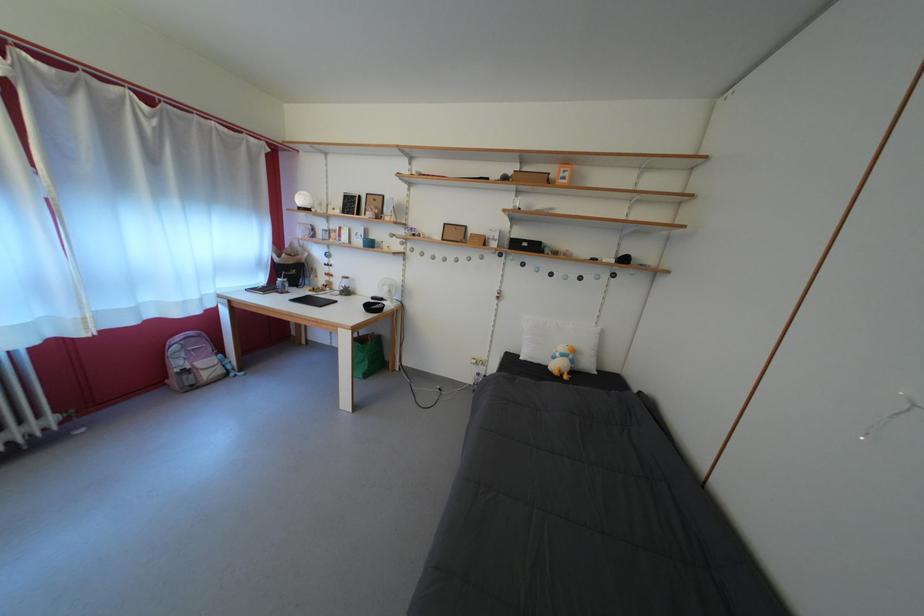
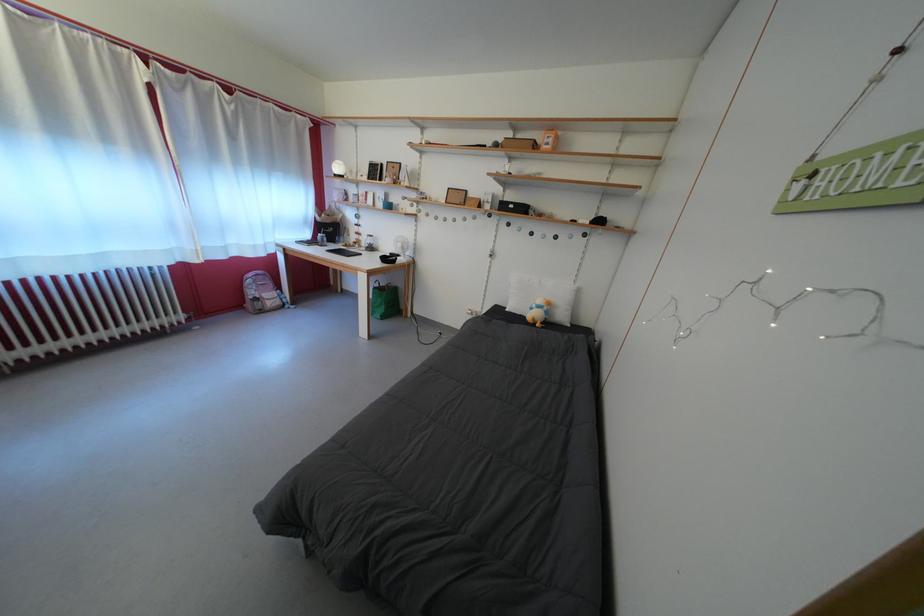
In the second image, find the point that corresponds to the point at 335,284 in the first image.

(365, 243)